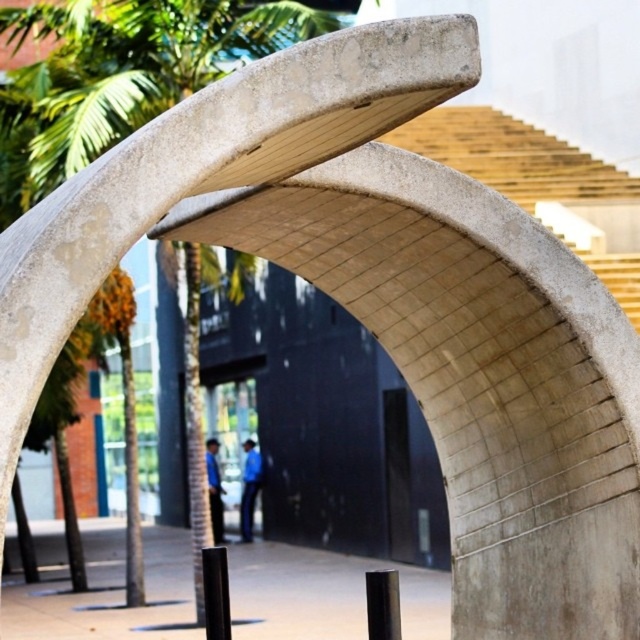
Question: From the image, what is the correct spatial relationship of smooth concrete post at center in relation to blue fabric pants at center?

Choices:
 (A) below
 (B) above

Answer: (A)

Question: Which object is positioned closest to the blue fabric pants at center?

Choices:
 (A) smooth concrete post at center
 (B) blue shirt at center

Answer: (B)

Question: Which point is farther to the camera?

Choices:
 (A) smooth concrete post at center
 (B) blue fabric pants at center
 (C) blue shirt at center

Answer: (B)

Question: Is the position of smooth concrete post at center less distant than that of blue shirt at center?

Choices:
 (A) yes
 (B) no

Answer: (A)

Question: Can you confirm if blue fabric pants at center is thinner than blue shirt at center?

Choices:
 (A) yes
 (B) no

Answer: (B)

Question: Which object is closer to the camera taking this photo?

Choices:
 (A) smooth concrete post at center
 (B) blue shirt at center
 (C) blue fabric pants at center

Answer: (A)